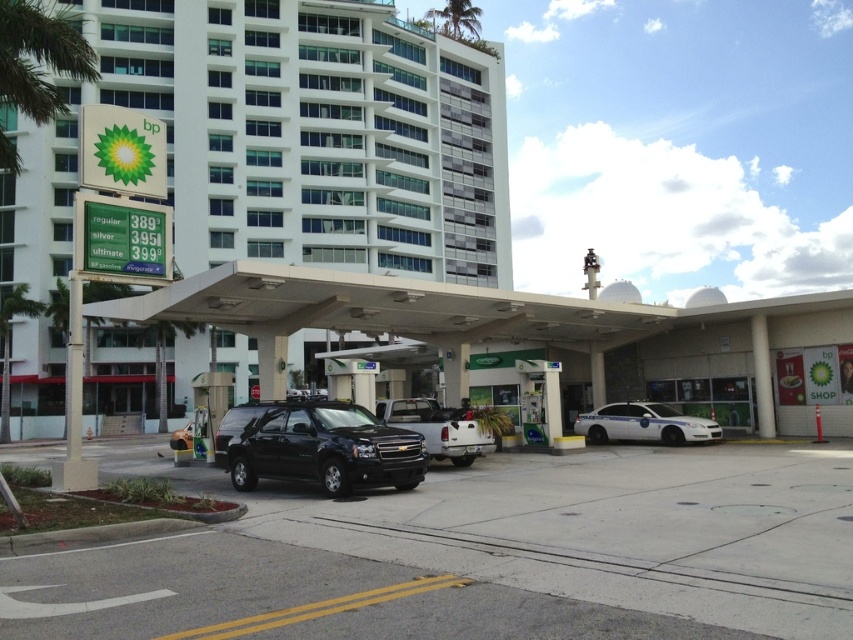
You are a photographer trying to capture both the white glass building at upper center and the white glossy police car at center in a single frame. Based on their sizes, which object would appear larger in the photo?

The white glass building at upper center appears larger than the white glossy police car at center because its width is greater than the police car.

You are a delivery driver who needs to park your truck between the white glass building at upper center and the white concrete parking garage at center. Can your truck, which is 12 meters long, fit in the space between them?

The distance between the white glass building at upper center and the white concrete parking garage at center is 15.25 meters. Since your truck is 12 meters long, it can fit in the space between them as there is enough room.

You are standing at the BP gas station and want to walk to the point labeled point (328, 106). Which direction should you go relative to point (381, 323)?

Point (328, 106) is behind point (381, 323), so you should walk in the direction away from point (381, 323) to reach it.